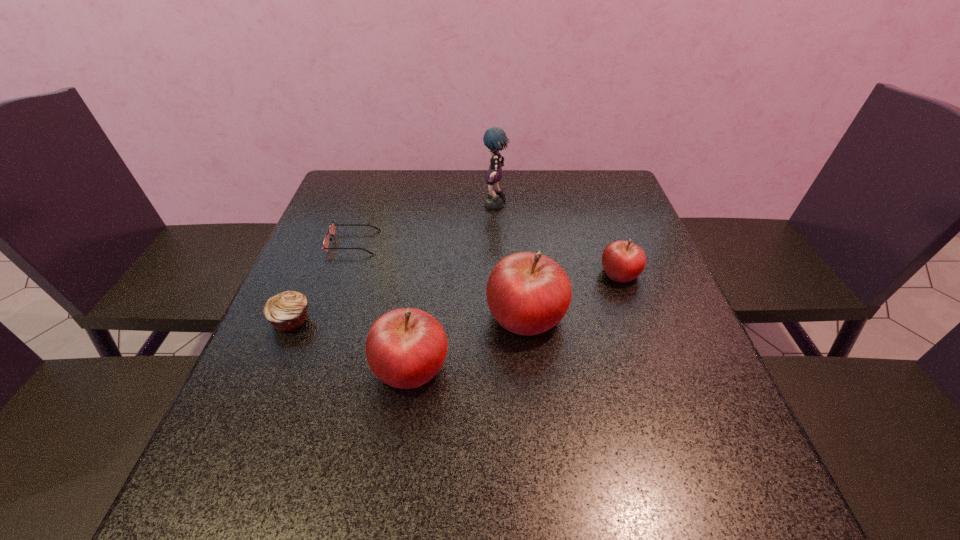
The image size is (960, 540). In order to click on free region located on the back of the second tallest apple in this screenshot , I will do `click(420, 303)`.

Locate an element on the screen. The width and height of the screenshot is (960, 540). free space located on the right of the second apple from left to right is located at coordinates (663, 315).

What are the coordinates of `free space located on the back of the fourth tallest object` in the screenshot? It's located at (605, 230).

The image size is (960, 540). In order to click on vacant space situated 0.080m on the front-facing side of the tallest object in this screenshot , I will do `click(455, 206)`.

Where is `vacant space situated 0.300m on the front-facing side of the tallest object`? The width and height of the screenshot is (960, 540). vacant space situated 0.300m on the front-facing side of the tallest object is located at coordinates (379, 206).

Identify the location of blank area located 0.120m on the front-facing side of the tallest object. (442, 206).

Find the location of a particular element. The height and width of the screenshot is (540, 960). vacant space situated on the bridge of the sunglasses is located at coordinates (396, 242).

Find the location of `free space located on the back of the fifth tallest object`. free space located on the back of the fifth tallest object is located at coordinates (309, 278).

Locate an element on the screen. The image size is (960, 540). object that is positioned at the far edge is located at coordinates (494, 139).

The height and width of the screenshot is (540, 960). Find the location of `sunglasses situated at the left edge`. sunglasses situated at the left edge is located at coordinates (331, 231).